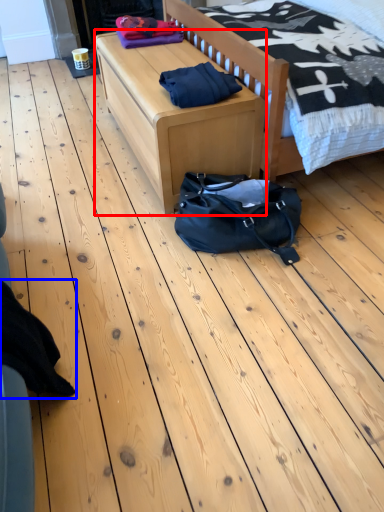
Question: Which object is closer to the camera taking this photo, table (highlighted by a red box) or clothing (highlighted by a blue box)?

Choices:
 (A) table
 (B) clothing

Answer: (B)